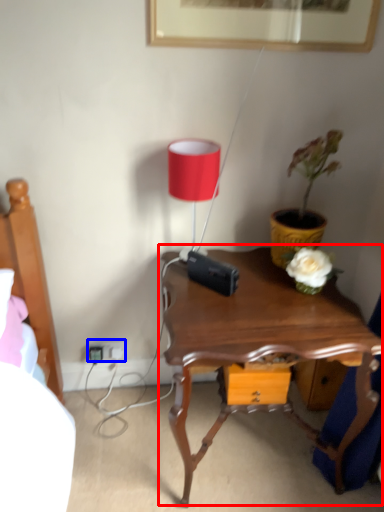
Question: Which object is further to the camera taking this photo, nightstand (highlighted by a red box) or electric outlet (highlighted by a blue box)?

Choices:
 (A) nightstand
 (B) electric outlet

Answer: (B)